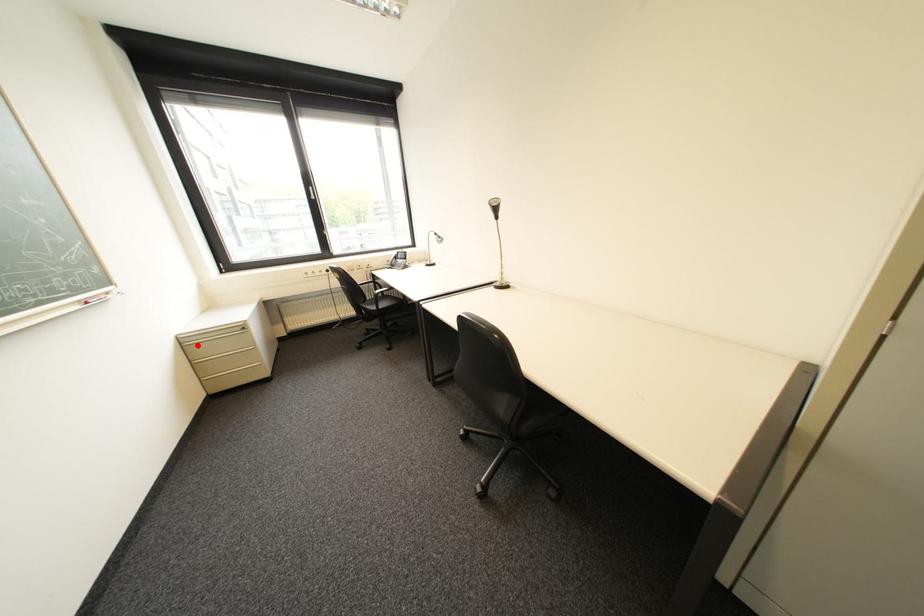
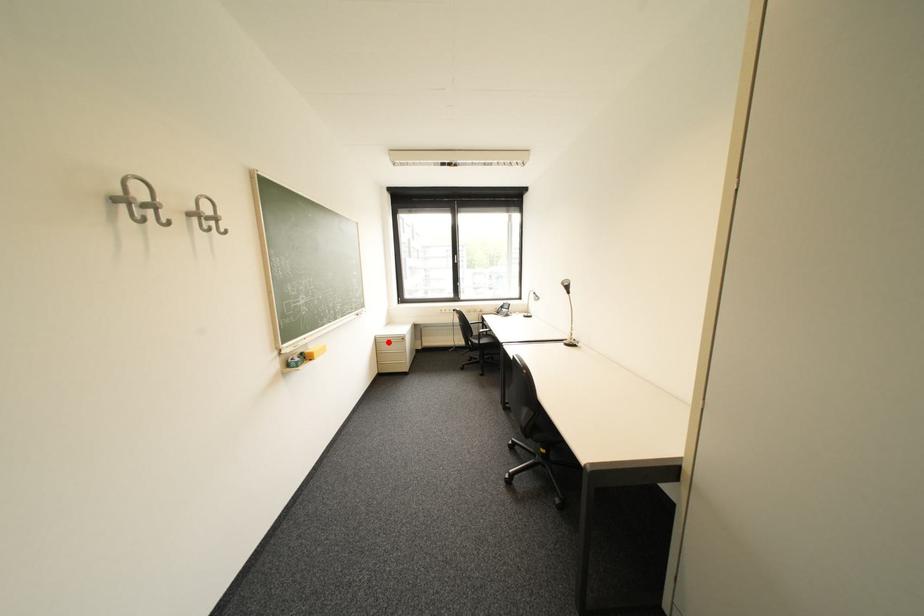
I am providing you with two images of the same scene from different viewpoints. A red point is marked on the first image and another point is marked on the second image. Is the marked point in image1 the same physical position as the marked point in image2?

Yes